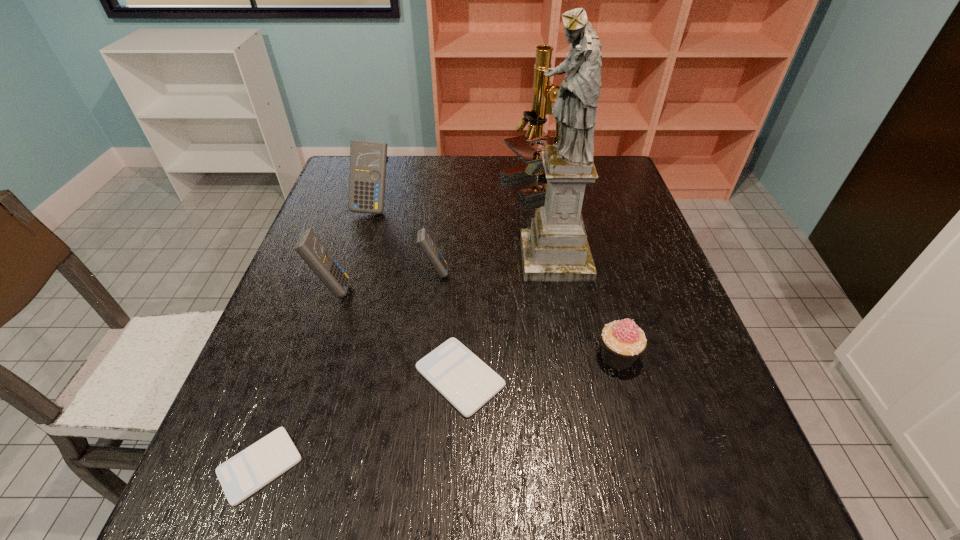
The height and width of the screenshot is (540, 960). I want to click on microscope present at the right edge, so click(544, 92).

Where is `cupcake that is at the right edge`? cupcake that is at the right edge is located at coordinates (622, 342).

This screenshot has width=960, height=540. Find the location of `object located in the far left corner section of the desktop`. object located in the far left corner section of the desktop is located at coordinates (367, 176).

Where is `object that is at the near left corner`? object that is at the near left corner is located at coordinates (244, 474).

Identify the location of object located in the far right corner section of the desktop. (544, 92).

The width and height of the screenshot is (960, 540). Find the location of `vacant space at the far edge of the desktop`. vacant space at the far edge of the desktop is located at coordinates (484, 163).

Where is `blank area at the near edge`? This screenshot has height=540, width=960. blank area at the near edge is located at coordinates (467, 515).

The height and width of the screenshot is (540, 960). I want to click on free region at the left edge, so click(x=314, y=302).

Where is `vacant space at the right edge of the desktop`? vacant space at the right edge of the desktop is located at coordinates (676, 373).

This screenshot has height=540, width=960. In the image, there is a desktop. What are the coordinates of `vacant area at the far left corner` in the screenshot? It's located at 341,169.